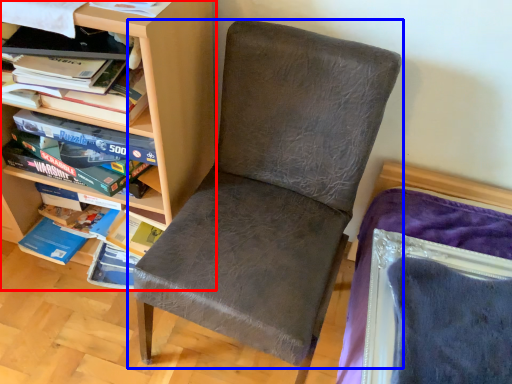
Question: Which object is further to the camera taking this photo, shelf (highlighted by a red box) or chair (highlighted by a blue box)?

Choices:
 (A) shelf
 (B) chair

Answer: (A)